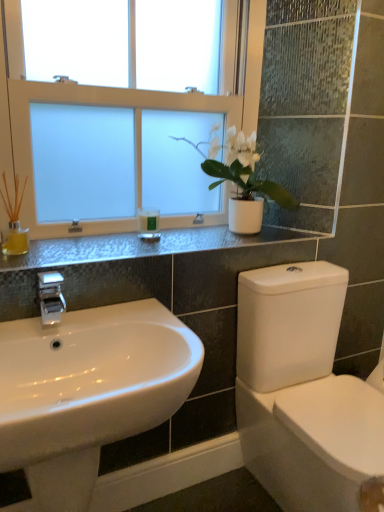
Question: Considering the relative positions of white frosted glass window at upper center and green matte candle at center in the image provided, is white frosted glass window at upper center to the right of green matte candle at center from the viewer's perspective?

Choices:
 (A) yes
 (B) no

Answer: (B)

Question: Does white frosted glass window at upper center have a larger size compared to green matte candle at center?

Choices:
 (A) no
 (B) yes

Answer: (B)

Question: Is green matte candle at center surrounded by white frosted glass window at upper center?

Choices:
 (A) yes
 (B) no

Answer: (B)

Question: Is white frosted glass window at upper center behind green matte candle at center?

Choices:
 (A) yes
 (B) no

Answer: (B)

Question: Can you confirm if white frosted glass window at upper center is wider than green matte candle at center?

Choices:
 (A) yes
 (B) no

Answer: (A)

Question: Is white matte plant pot at upper center taller or shorter than white frosted glass window at upper center?

Choices:
 (A) tall
 (B) short

Answer: (B)

Question: Considering the positions of point click(251, 197) and point click(91, 224), is point click(251, 197) closer or farther from the camera than point click(91, 224)?

Choices:
 (A) farther
 (B) closer

Answer: (A)

Question: From the image's perspective, is white matte plant pot at upper center located above or below white frosted glass window at upper center?

Choices:
 (A) below
 (B) above

Answer: (A)

Question: From a real-world perspective, relative to white frosted glass window at upper center, is white matte plant pot at upper center vertically above or below?

Choices:
 (A) below
 (B) above

Answer: (A)

Question: Is point (213, 111) closer or farther from the camera than point (349, 501)?

Choices:
 (A) farther
 (B) closer

Answer: (A)

Question: From the image's perspective, relative to white glossy bidet at lower right, is white frosted glass window at upper center above or below?

Choices:
 (A) above
 (B) below

Answer: (A)

Question: Considering the positions of white frosted glass window at upper center and white glossy bidet at lower right in the image, is white frosted glass window at upper center taller or shorter than white glossy bidet at lower right?

Choices:
 (A) tall
 (B) short

Answer: (A)

Question: Is white frosted glass window at upper center inside or outside of white glossy bidet at lower right?

Choices:
 (A) inside
 (B) outside

Answer: (B)

Question: Is green matte candle at center wider or thinner than white frosted glass window at upper center?

Choices:
 (A) wide
 (B) thin

Answer: (B)

Question: Considering their positions, is green matte candle at center located in front of or behind white frosted glass window at upper center?

Choices:
 (A) behind
 (B) front

Answer: (A)